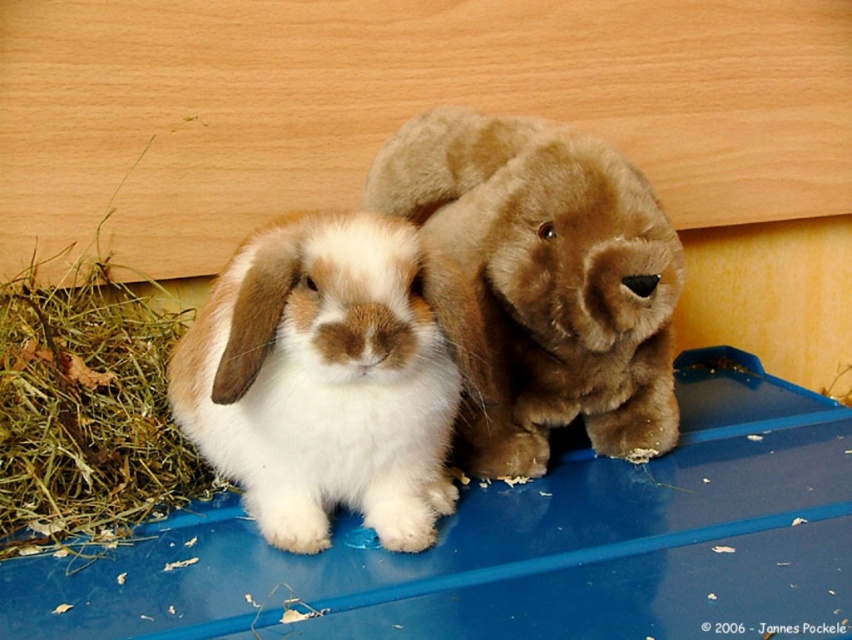
Question: Does white soft fur rabbit at center appear over brown plush toy at center?

Choices:
 (A) no
 (B) yes

Answer: (A)

Question: Can you confirm if white soft fur rabbit at center is smaller than brown plush toy at center?

Choices:
 (A) yes
 (B) no

Answer: (A)

Question: Does white soft fur rabbit at center have a smaller size compared to brown plush toy at center?

Choices:
 (A) no
 (B) yes

Answer: (B)

Question: Which point is closer to the camera?

Choices:
 (A) (426, 308)
 (B) (490, 424)

Answer: (A)

Question: Which point appears farthest from the camera in this image?

Choices:
 (A) (344, 212)
 (B) (542, 436)

Answer: (B)